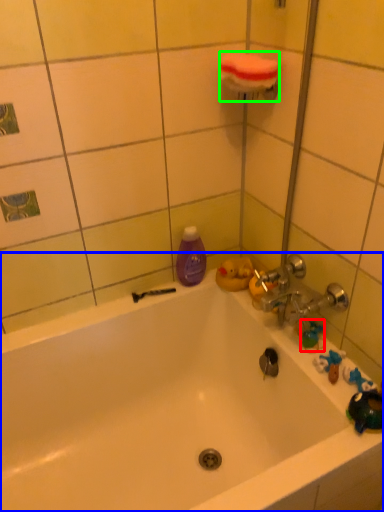
Question: Based on their relative distances, which object is farther from toy (highlighted by a red box)? Choose from bathtub (highlighted by a blue box) and towel bar (highlighted by a green box).

Choices:
 (A) bathtub
 (B) towel bar

Answer: (B)